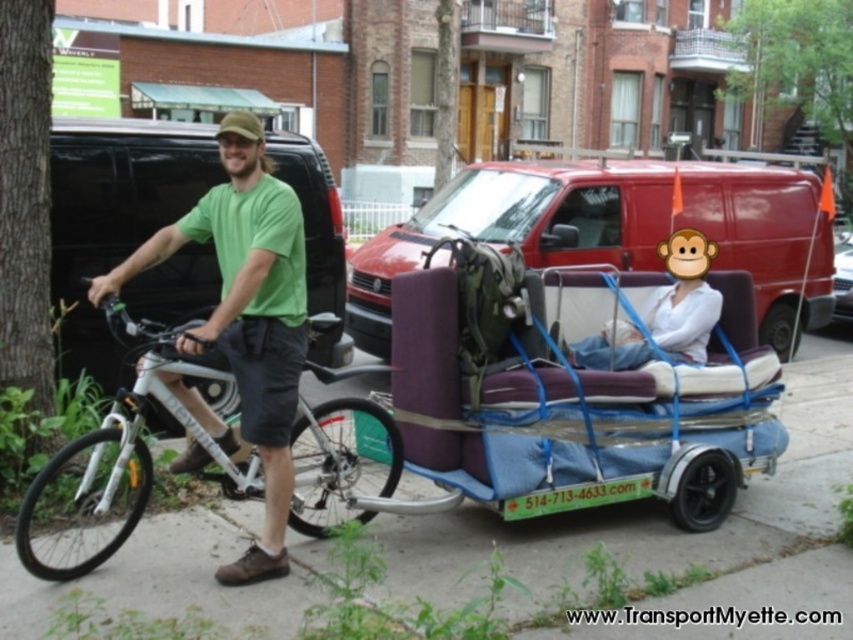
You are a delivery person trying to navigate through a narrow alley that is only 1.5 meters wide. You see the purple fabric baby carriage at center and the matte purple couch at center in your path. Which object would you need to move to pass through the alley safely?

The purple fabric baby carriage at center might be wider than the matte purple couch at center. Since the alley is only 1.5 meters wide, you should move the object that is wider to ensure there is enough space. If the baby carriage is indeed wider, moving it would allow the couch to fit through the alley.

You are standing in front of the bicycle with a trailer. You notice the matte purple couch at center and the green matte shirt at center. Which object is taller?

The green matte shirt at center is taller than the matte purple couch at center.

You are standing at point A located at coordinates point A at point (761, 196). You want to move to point B which is 9.53 meters away from point A. Can you reach point B in 10 seconds if you run at a speed of 10 meters per second?

Yes, because 10 meters per second multiplied by 10 seconds equals 100 meters, which is more than enough to cover the 9.53 meters distance between point A at point (761, 196) and point B.